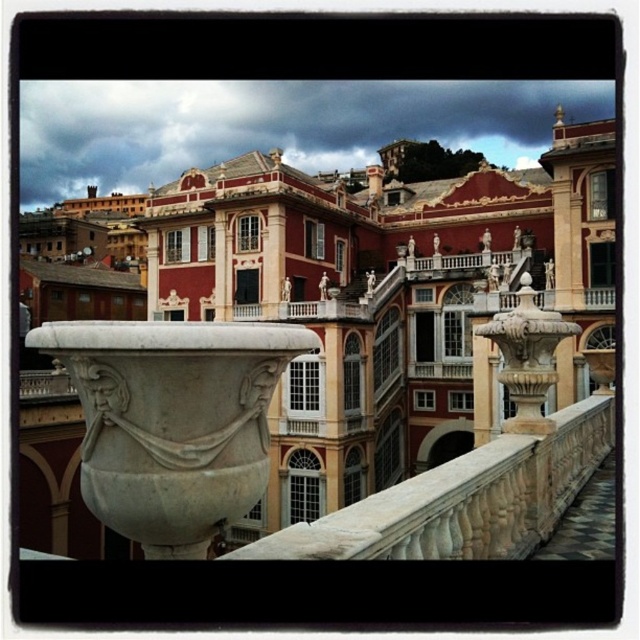
Is point (545, 182) positioned behind point (172, 394)?

Yes, it is.

Between point (445, 458) and point (244, 422), which one is positioned behind?

Point (445, 458)

This screenshot has width=640, height=640. I want to click on matte stone palace at center, so click(x=353, y=292).

Is point (262, 388) positioned in front of point (509, 508)?

Yes, it is in front of point (509, 508).

Is white marble urn at center to the left of white stone railing at center from the viewer's perspective?

Correct, you'll find white marble urn at center to the left of white stone railing at center.

Where is `white marble urn at center`? white marble urn at center is located at coordinates (172, 420).

Is matte stone palace at center behind white stone railing at center?

Yes.

Can you confirm if matte stone palace at center is wider than white stone railing at center?

Yes.

Is point (243, 161) closer to camera compared to point (547, 440)?

No, (243, 161) is behind (547, 440).

Image resolution: width=640 pixels, height=640 pixels. What are the coordinates of `matte stone palace at center` in the screenshot? It's located at (353, 292).